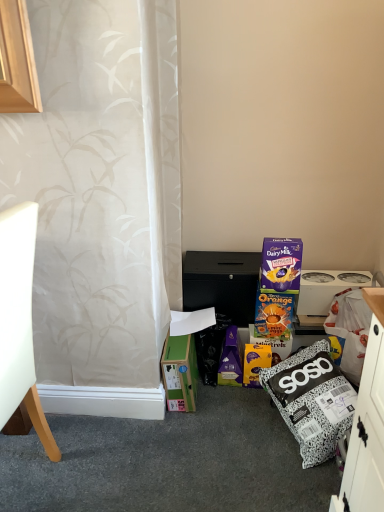
Question: Is white matte chair at left to the left or to the right of white plastic appliance at right in the image?

Choices:
 (A) right
 (B) left

Answer: (B)

Question: Do you think white matte chair at left is within white plastic appliance at right, or outside of it?

Choices:
 (A) outside
 (B) inside

Answer: (A)

Question: Which is farther from the white matte chair at left?

Choices:
 (A) white plastic appliance at right
 (B) green cardboard box at lower left
 (C) black matte cabinet at center

Answer: (A)

Question: Estimate the real-world distances between objects in this image. Which object is closer to the white plastic appliance at right?

Choices:
 (A) black matte cabinet at center
 (B) white matte chair at left
 (C) green cardboard box at lower left

Answer: (A)